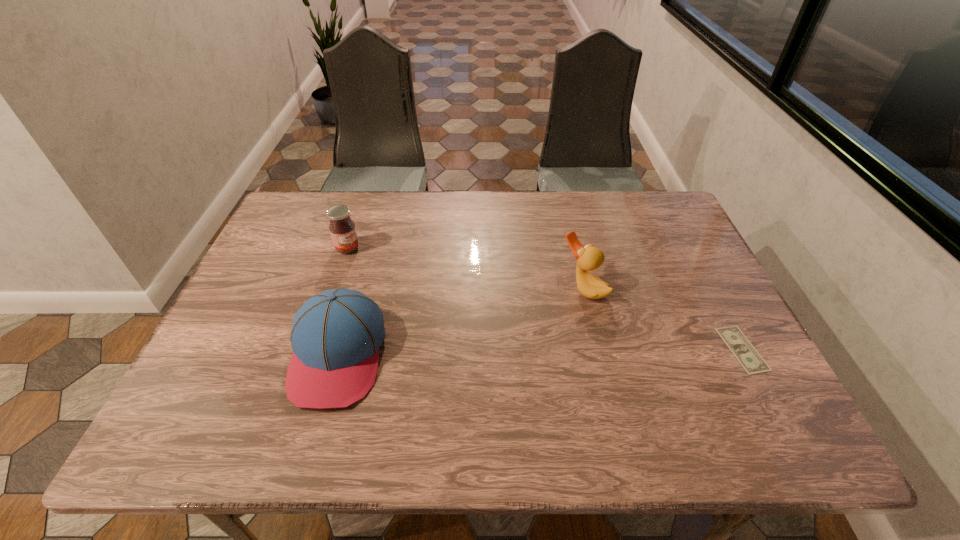
I want to click on vacant space located 0.350m on the beak of the third object from left to right, so click(x=460, y=373).

Image resolution: width=960 pixels, height=540 pixels. Find the location of `free region located 0.160m on the beak of the third object from left to right`. free region located 0.160m on the beak of the third object from left to right is located at coordinates (523, 330).

The width and height of the screenshot is (960, 540). In order to click on free region located on the beak of the third object from left to right in this screenshot , I will do `click(492, 352)`.

This screenshot has height=540, width=960. In order to click on baseball cap present at the near edge in this screenshot , I will do `click(336, 335)`.

Where is `money positioned at the near edge`? The height and width of the screenshot is (540, 960). money positioned at the near edge is located at coordinates (748, 357).

The height and width of the screenshot is (540, 960). I want to click on object that is at the right edge, so click(748, 357).

I want to click on object that is positioned at the near right corner, so click(748, 357).

You are a GUI agent. You are given a task and a screenshot of the screen. Output one action in this format:
    pyautogui.click(x=<x>, y=<y>)
    Task: Click on the vacant space at the far edge of the desktop
    
    Given the screenshot: What is the action you would take?
    pyautogui.click(x=367, y=209)

In the image, there is a desktop. Where is `vacant area at the near edge`? This screenshot has height=540, width=960. vacant area at the near edge is located at coordinates (436, 369).

Image resolution: width=960 pixels, height=540 pixels. I want to click on vacant space at the left edge of the desktop, so click(x=284, y=296).